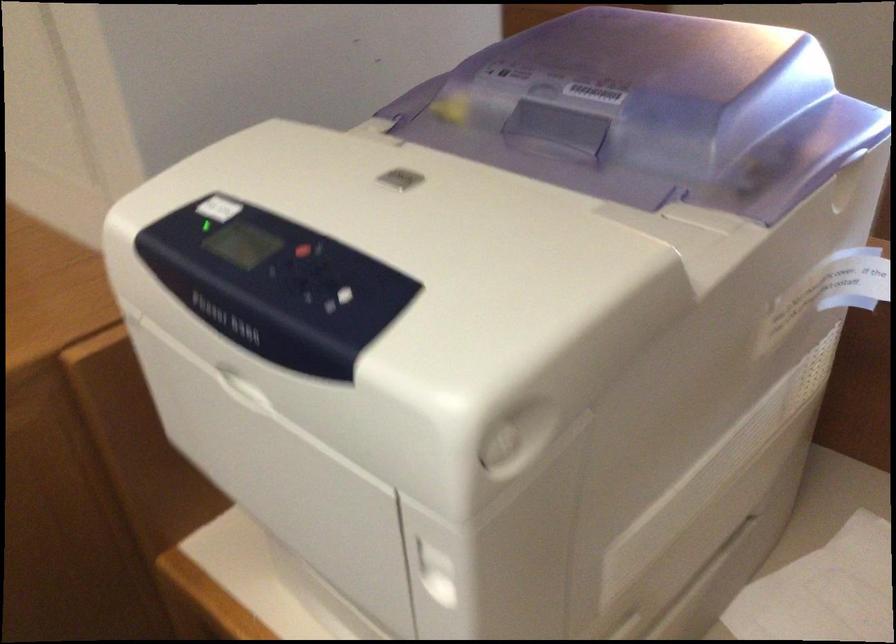
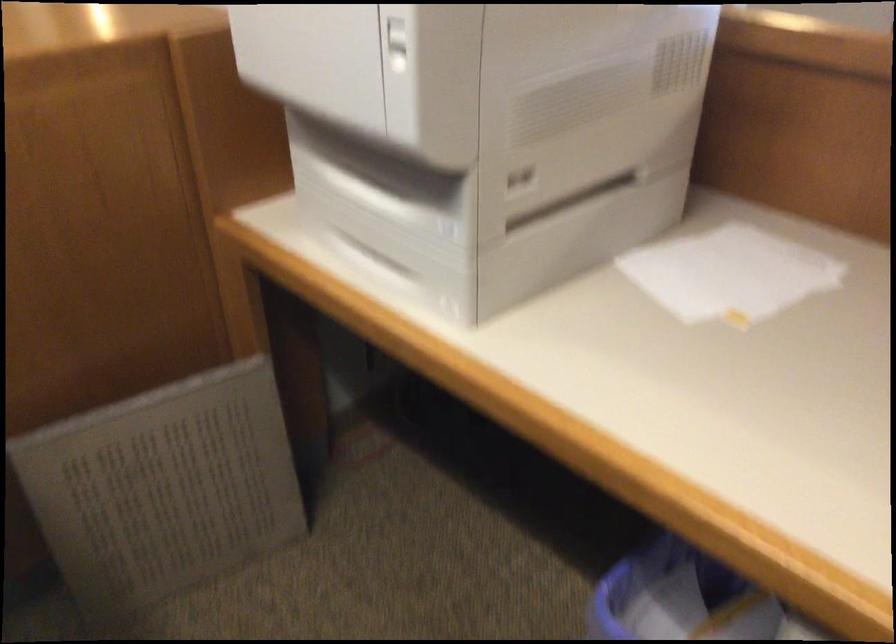
Question: The camera is either moving clockwise (left) or counter-clockwise (right) around the object. The first image is from the beginning of the video and the second image is from the end. Is the camera moving left or right when shooting the video?

Choices:
 (A) Left
 (B) Right

Answer: (B)